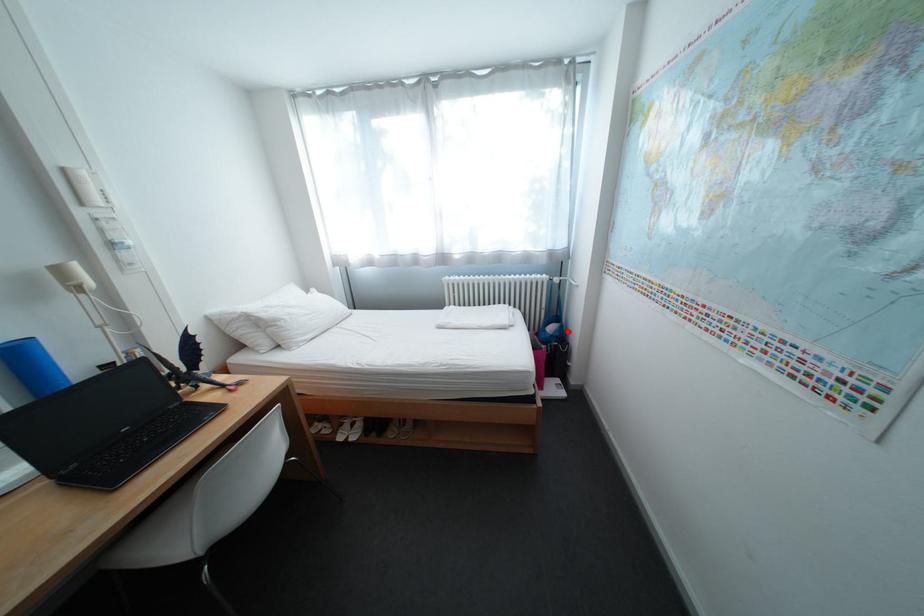
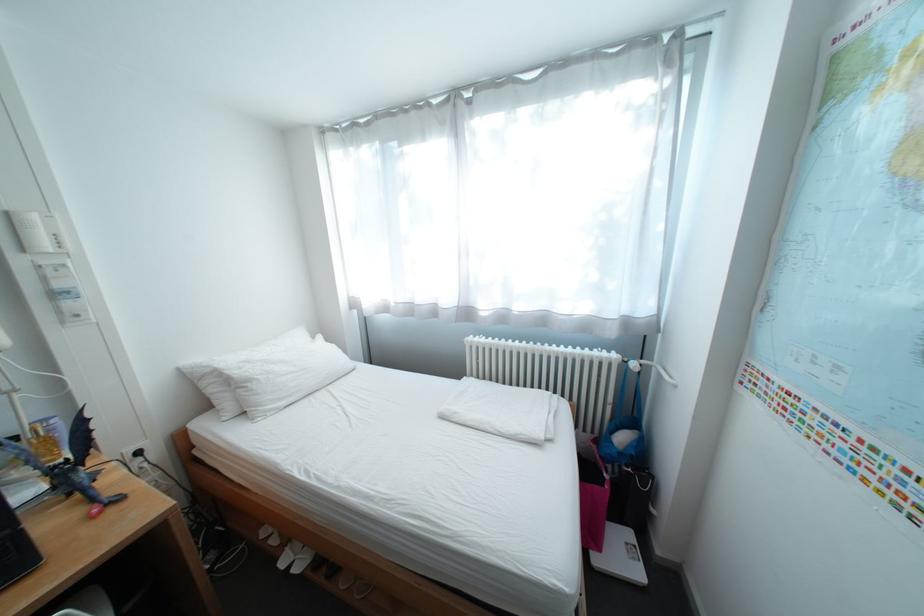
In the second image, find the point that corresponds to the highlighted location in the first image.

(642, 447)